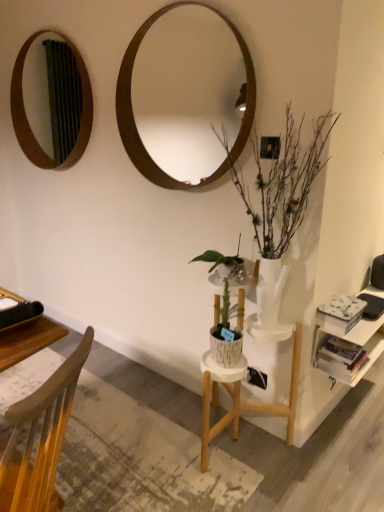
Question: Is wooden mirror at upper center, which is the 2th mirror in left-to-right order, in front of or behind wooden mirror at upper left, acting as the 2th mirror starting from the front, in the image?

Choices:
 (A) front
 (B) behind

Answer: (A)

Question: Is wooden mirror at upper center, which ranks as the 1th mirror in right-to-left order, inside the boundaries of wooden mirror at upper left, placed as the first mirror when sorted from left to right, or outside?

Choices:
 (A) inside
 (B) outside

Answer: (B)

Question: Which object is positioned farthest from the wooden mirror at upper center, which ranks as the 1th mirror in right-to-left order?

Choices:
 (A) hardcover book at right, which ranks as the 1th book in bottom-to-top order
 (B) wooden mirror at upper left, arranged as the 1th mirror when viewed from the back
 (C) wooden chair at lower left
 (D) white glossy vase at right
 (E) white matte bookshelf at right

Answer: (C)

Question: Which of these objects is positioned closest to the wooden mirror at upper left, placed as the first mirror when sorted from left to right?

Choices:
 (A) wooden mirror at upper center, marked as the second mirror in a back-to-front arrangement
 (B) white glossy vase at right
 (C) white matte book at right, acting as the 1th book starting from the top
 (D) wooden chair at lower left
 (E) white matte bookshelf at right

Answer: (A)